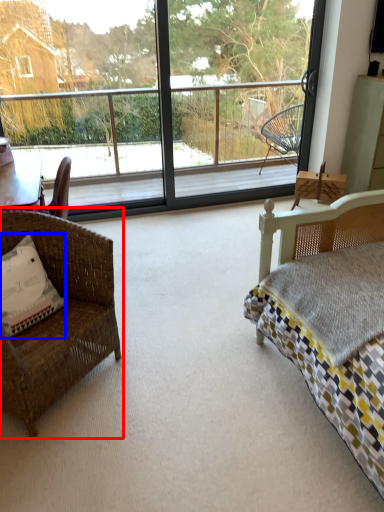
Question: Among these objects, which one is nearest to the camera, chair (highlighted by a red box) or pillow (highlighted by a blue box)?

Choices:
 (A) chair
 (B) pillow

Answer: (A)